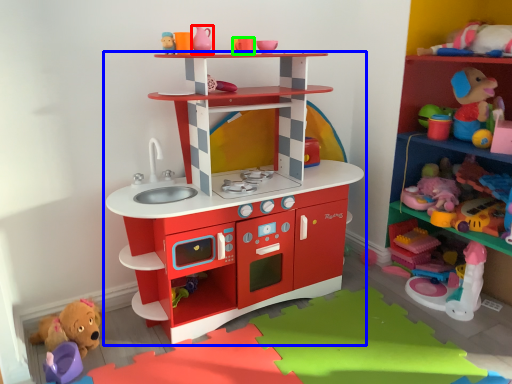
Question: Estimate the real-world distances between objects in this image. Which object is closer to toy (highlighted by a red box), shelf (highlighted by a blue box) or toy (highlighted by a green box)?

Choices:
 (A) shelf
 (B) toy

Answer: (B)